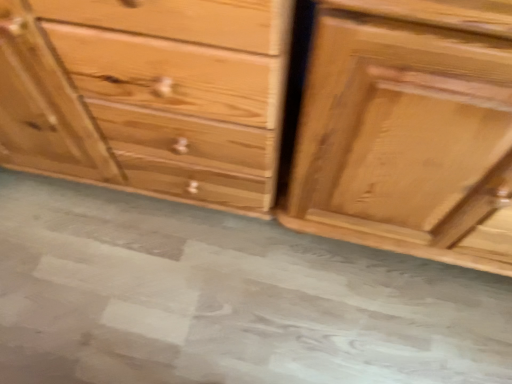
Question: From a real-world perspective, is natural wood chest of drawers at center, which is counted as the second chest of drawers, starting from the right, below shiny brown wood drawer at right, which is the 2th chest of drawers from left to right?

Choices:
 (A) no
 (B) yes

Answer: (B)

Question: Is natural wood chest of drawers at center, which is counted as the second chest of drawers, starting from the right, oriented towards shiny brown wood drawer at right, which is the 2th chest of drawers from left to right?

Choices:
 (A) no
 (B) yes

Answer: (A)

Question: Does natural wood chest of drawers at center, which is the first chest of drawers in left-to-right order, come in front of shiny brown wood drawer at right, which is the 2th chest of drawers from left to right?

Choices:
 (A) no
 (B) yes

Answer: (A)

Question: Does natural wood chest of drawers at center, which is the first chest of drawers in left-to-right order, have a greater height compared to shiny brown wood drawer at right, which is the 2th chest of drawers from left to right?

Choices:
 (A) no
 (B) yes

Answer: (A)

Question: Considering the relative sizes of natural wood chest of drawers at center, which is counted as the second chest of drawers, starting from the right, and shiny brown wood drawer at right, which is the 2th chest of drawers from left to right, in the image provided, is natural wood chest of drawers at center, which is counted as the second chest of drawers, starting from the right, wider than shiny brown wood drawer at right, which is the 2th chest of drawers from left to right,?

Choices:
 (A) no
 (B) yes

Answer: (B)

Question: In the image, is gray concrete at center on the left side or the right side of shiny brown wood drawer at right, which is the 2th chest of drawers from left to right?

Choices:
 (A) left
 (B) right

Answer: (A)

Question: Relative to shiny brown wood drawer at right, which is the 2th chest of drawers from left to right, is gray concrete at center in front or behind?

Choices:
 (A) front
 (B) behind

Answer: (B)

Question: From the image's perspective, is gray concrete at center located above or below shiny brown wood drawer at right, the 1th chest of drawers viewed from the right?

Choices:
 (A) below
 (B) above

Answer: (A)

Question: Which is correct: gray concrete at center is inside shiny brown wood drawer at right, the 1th chest of drawers viewed from the right, or outside of it?

Choices:
 (A) inside
 (B) outside

Answer: (B)

Question: Visually, is natural wood chest of drawers at center, which is the first chest of drawers in left-to-right order, positioned to the left or to the right of gray concrete at center?

Choices:
 (A) left
 (B) right

Answer: (A)

Question: From the image's perspective, is natural wood chest of drawers at center, which is counted as the second chest of drawers, starting from the right, located above or below gray concrete at center?

Choices:
 (A) above
 (B) below

Answer: (A)

Question: Is natural wood chest of drawers at center, which is counted as the second chest of drawers, starting from the right, inside the boundaries of gray concrete at center, or outside?

Choices:
 (A) inside
 (B) outside

Answer: (B)

Question: Is natural wood chest of drawers at center, which is the first chest of drawers in left-to-right order, wider or thinner than gray concrete at center?

Choices:
 (A) thin
 (B) wide

Answer: (A)

Question: Is gray concrete at center wider or thinner than natural wood chest of drawers at center, which is counted as the second chest of drawers, starting from the right?

Choices:
 (A) thin
 (B) wide

Answer: (B)

Question: In terms of size, does gray concrete at center appear bigger or smaller than natural wood chest of drawers at center, which is the first chest of drawers in left-to-right order?

Choices:
 (A) small
 (B) big

Answer: (A)